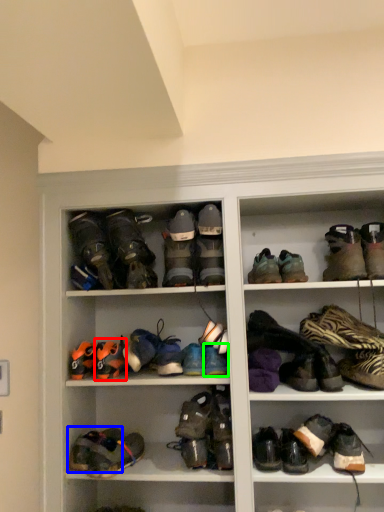
Question: Which object is the farthest from footwear (highlighted by a red box)? Choose among these: footwear (highlighted by a blue box) or footwear (highlighted by a green box).

Choices:
 (A) footwear
 (B) footwear

Answer: (B)